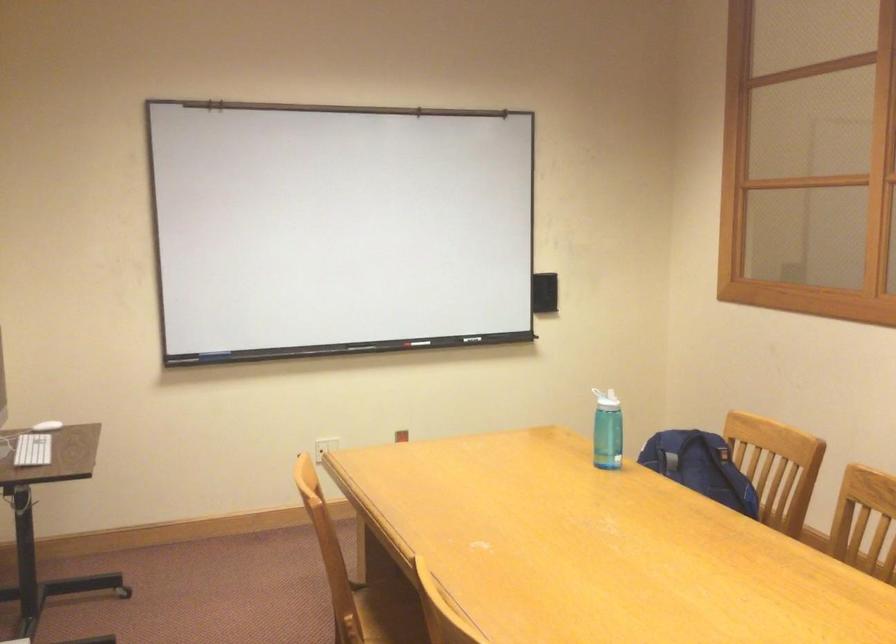
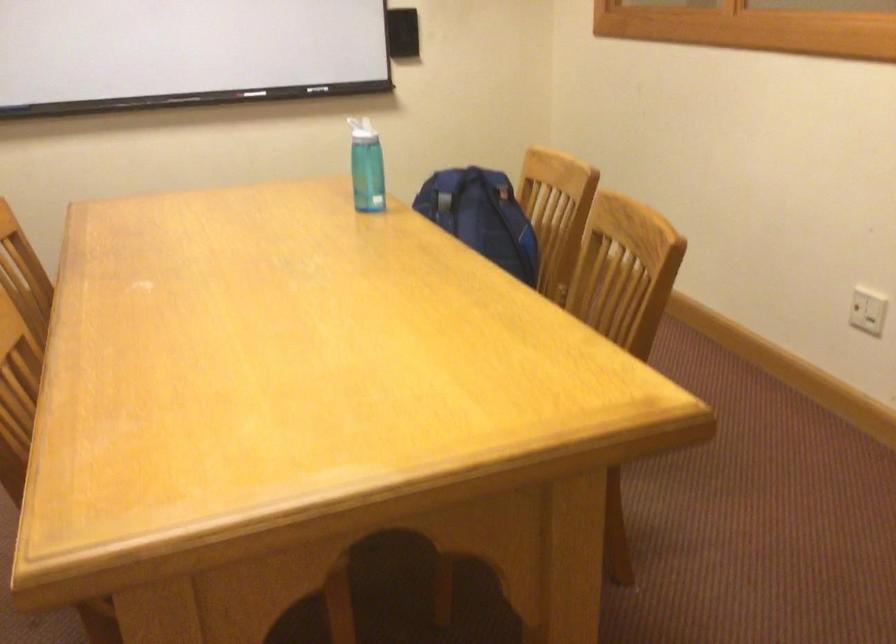
Question: I am providing you with two images of the same scene from different viewpoints. Which of the following objects are not visible in image2?

Choices:
 (A) tan window shade
 (B) wooden chair sitting surface
 (C) backpack top handle
 (D) white bottle lid

Answer: (B)